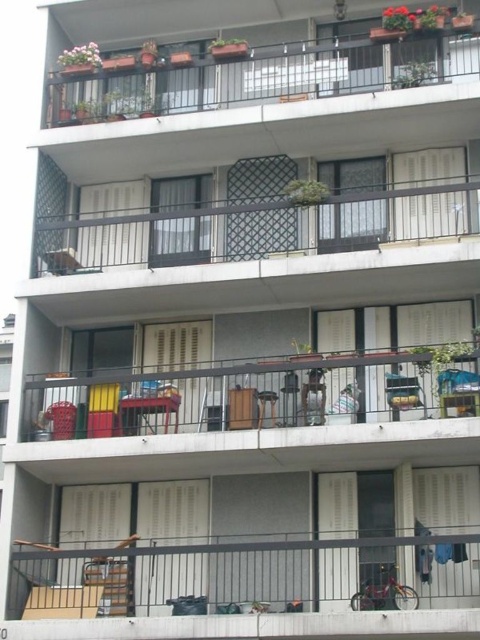
You are standing on the ground floor looking up at the building. There is a point marked at coordinates (263, 568). What object does this point correspond to?

The point corresponds to the metallic gray railing at lower center.

You are standing on the sidewalk in front of the residential building and want to place a new potted plant between the metallic gray furniture at lower left and the metallic silver chair at center. Can you tell me which object the plant will be closer to?

The metallic gray furniture at lower left is in front of the metallic silver chair at center, so the plant placed between them will be closer to the metallic gray furniture at lower left.

You are a painter who needs to place a ladder against the metallic gray railing at lower center and the metallic silver chair at center. Which object requires a taller ladder to reach its top?

The metallic gray railing at lower center requires a taller ladder since it is much taller than the metallic silver chair at center.